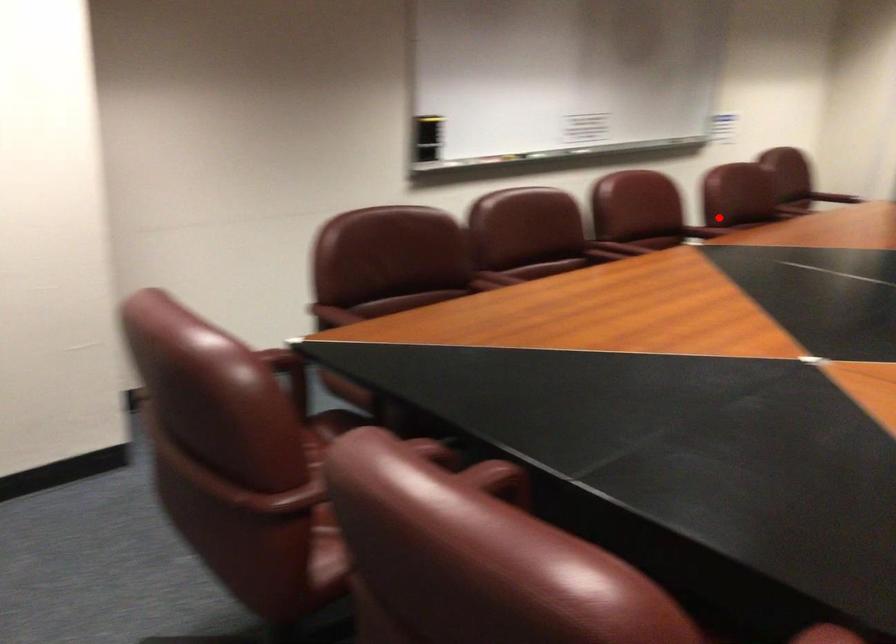
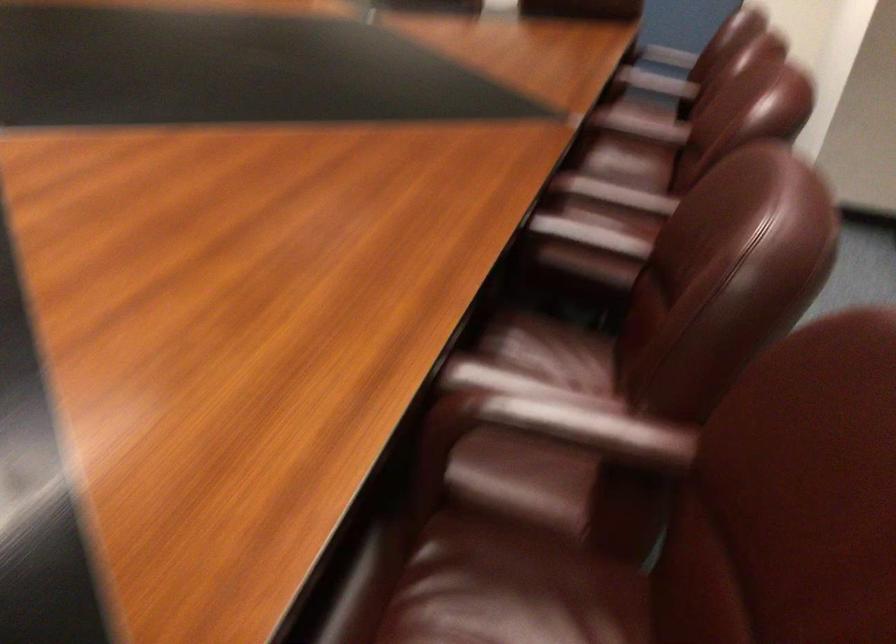
In the second image, find the point that corresponds to the highlighted location in the first image.

(613, 194)